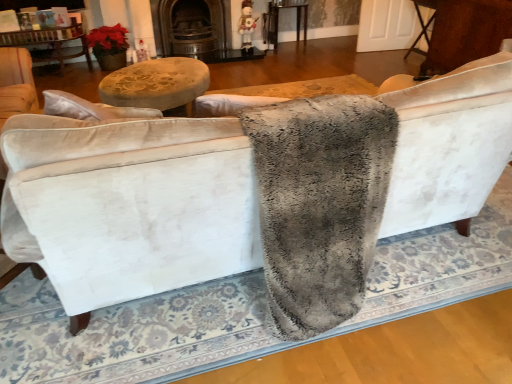
I want to click on gray fluffy blanket at center, so click(x=319, y=204).

I want to click on wooden table at center, placed as the 1th table when sorted from back to front, so click(x=278, y=19).

Where is `dark brown wood fireplace at upper center`? dark brown wood fireplace at upper center is located at coordinates (190, 27).

Find the location of a particular element. gray fluffy blanket at center is located at coordinates (319, 204).

How many degrees apart are the facing directions of wooden table at center, placed as the 2th table when sorted from front to back, and gray fluffy blanket at center?

They differ by 179 degrees in their facing directions.

Does wooden table at center, placed as the 2th table when sorted from front to back, have a lesser width compared to gray fluffy blanket at center?

Correct, the width of wooden table at center, placed as the 2th table when sorted from front to back, is less than that of gray fluffy blanket at center.

In the scene shown: Does wooden table at center, placed as the 2th table when sorted from front to back, have a smaller size compared to gray fluffy blanket at center?

Yes, wooden table at center, placed as the 2th table when sorted from front to back, is smaller than gray fluffy blanket at center.

Is wooden table at center, acting as the 1th table starting from the left, outside of gray fluffy blanket at center?

Yes.

Can you confirm if brown wood table at right, the second table positioned from the left, is bigger than gray fluffy blanket at center?

Actually, brown wood table at right, the second table positioned from the left, might be smaller than gray fluffy blanket at center.

In the image, is brown wood table at right, the second table viewed from the back, positioned in front of or behind gray fluffy blanket at center?

Clearly, brown wood table at right, the second table viewed from the back, is behind gray fluffy blanket at center.

Image resolution: width=512 pixels, height=384 pixels. There is a gray fluffy blanket at center. Identify the location of the 1st table below it (from a real-world perspective). (466, 32).

Does point (499, 0) appear closer or farther from the camera than point (349, 191)?

Point (499, 0) appears to be farther away from the viewer than point (349, 191).

Which of these two, gray fluffy blanket at center or wooden table at center, acting as the 1th table starting from the left, stands taller?

Standing taller between the two is gray fluffy blanket at center.

Which is behind, gray fluffy blanket at center or wooden table at center, placed as the 1th table when sorted from back to front?

wooden table at center, placed as the 1th table when sorted from back to front, is behind.

Does gray fluffy blanket at center have a greater width compared to wooden table at center, which is the 2th table from right to left?

Indeed, gray fluffy blanket at center has a greater width compared to wooden table at center, which is the 2th table from right to left.

Between dark brown wood fireplace at upper center and wooden table at center, which is the 2th table from right to left, which one appears on the right side from the viewer's perspective?

wooden table at center, which is the 2th table from right to left.

Is point (209, 17) less distant than point (305, 41)?

Yes, point (209, 17) is in front of point (305, 41).

From a real-world perspective, does dark brown wood fireplace at upper center stand above wooden table at center, acting as the 1th table starting from the left?

Indeed, from a real-world perspective, dark brown wood fireplace at upper center stands above wooden table at center, acting as the 1th table starting from the left.

Would you consider dark brown wood fireplace at upper center to be distant from wooden table at center, placed as the 1th table when sorted from back to front?

No, dark brown wood fireplace at upper center is in close proximity to wooden table at center, placed as the 1th table when sorted from back to front.

Looking at their sizes, would you say gray fluffy blanket at center is wider or thinner than brown wood table at right, the first table positioned from the right?

Clearly, gray fluffy blanket at center has more width compared to brown wood table at right, the first table positioned from the right.

From a real-world perspective, is gray fluffy blanket at center under brown wood table at right, the first table positioned from the right?

No.

Is gray fluffy blanket at center at the right side of brown wood table at right, the first table positioned from the right?

Incorrect, gray fluffy blanket at center is not on the right side of brown wood table at right, the first table positioned from the right.

Is gray fluffy blanket at center far away from brown wood table at right, the second table positioned from the left?

Yes, gray fluffy blanket at center and brown wood table at right, the second table positioned from the left, are quite far apart.

Locate an element on the screen. This screenshot has height=384, width=512. blanket below the dark brown wood fireplace at upper center (from the image's perspective) is located at coordinates (319, 204).

Is gray fluffy blanket at center positioned far away from dark brown wood fireplace at upper center?

That's right, there is a large distance between gray fluffy blanket at center and dark brown wood fireplace at upper center.

From the picture: How many degrees apart are the facing directions of gray fluffy blanket at center and dark brown wood fireplace at upper center?

179 degrees.

From a real-world perspective, which object stands above the other?

gray fluffy blanket at center, from a real-world perspective.

Would you consider brown wood table at right, the second table positioned from the left, to be distant from wooden table at center, placed as the 2th table when sorted from front to back?

brown wood table at right, the second table positioned from the left, is positioned a significant distance from wooden table at center, placed as the 2th table when sorted from front to back.

Can you confirm if brown wood table at right, which appears as the 1th table when viewed from the front, is bigger than wooden table at center, acting as the 1th table starting from the left?

Correct, brown wood table at right, which appears as the 1th table when viewed from the front, is larger in size than wooden table at center, acting as the 1th table starting from the left.

Relative to wooden table at center, placed as the 2th table when sorted from front to back, is brown wood table at right, the first table positioned from the right, in front or behind?

Clearly, brown wood table at right, the first table positioned from the right, is in front of wooden table at center, placed as the 2th table when sorted from front to back.

The height and width of the screenshot is (384, 512). Identify the location of table that is the 2nd object located above the gray fluffy blanket at center (from the image's perspective). (278, 19).

Locate an element on the screen. blanket above the brown wood table at right, the first table positioned from the right (from a real-world perspective) is located at coordinates (319, 204).

Based on their spatial positions, is dark brown wood fireplace at upper center or gray fluffy blanket at center closer to brown wood table at right, the first table positioned from the right?

dark brown wood fireplace at upper center is closer to brown wood table at right, the first table positioned from the right.

Looking at the image, which one is located further to gray fluffy blanket at center, dark brown wood fireplace at upper center or wooden table at center, which is the 2th table from right to left?

wooden table at center, which is the 2th table from right to left, lies further to gray fluffy blanket at center than the other object.

Looking at the image, which one is located closer to gray fluffy blanket at center, brown wood table at right, the first table positioned from the right, or dark brown wood fireplace at upper center?

brown wood table at right, the first table positioned from the right, is positioned closer to the anchor gray fluffy blanket at center.

Estimate the real-world distances between objects in this image. Which object is further from dark brown wood fireplace at upper center, wooden table at center, placed as the 2th table when sorted from front to back, or brown wood table at right, the first table positioned from the right?

brown wood table at right, the first table positioned from the right, lies further to dark brown wood fireplace at upper center than the other object.

Considering their positions, is wooden table at center, which is the 2th table from right to left, positioned further to gray fluffy blanket at center than dark brown wood fireplace at upper center?

wooden table at center, which is the 2th table from right to left.

Considering their positions, is wooden table at center, placed as the 1th table when sorted from back to front, positioned closer to brown wood table at right, which appears as the 1th table when viewed from the front, than dark brown wood fireplace at upper center?

Among the two, wooden table at center, placed as the 1th table when sorted from back to front, is located nearer to brown wood table at right, which appears as the 1th table when viewed from the front.

Which object lies nearer to the anchor point dark brown wood fireplace at upper center, wooden table at center, placed as the 1th table when sorted from back to front, or gray fluffy blanket at center?

wooden table at center, placed as the 1th table when sorted from back to front, is closer to dark brown wood fireplace at upper center.

Considering their positions, is gray fluffy blanket at center positioned further to wooden table at center, placed as the 2th table when sorted from front to back, than dark brown wood fireplace at upper center?

gray fluffy blanket at center is positioned further to the anchor wooden table at center, placed as the 2th table when sorted from front to back.

Find the location of `fireplace between gray fluffy blanket at center and wooden table at center, acting as the 1th table starting from the left, in the front-back direction`. fireplace between gray fluffy blanket at center and wooden table at center, acting as the 1th table starting from the left, in the front-back direction is located at coordinates (190, 27).

Find the location of a particular element. The width and height of the screenshot is (512, 384). table between gray fluffy blanket at center and dark brown wood fireplace at upper center in the front-back direction is located at coordinates (466, 32).

Where is `table situated between dark brown wood fireplace at upper center and brown wood table at right, the second table positioned from the left, from left to right`? table situated between dark brown wood fireplace at upper center and brown wood table at right, the second table positioned from the left, from left to right is located at coordinates (278, 19).

Identify the location of table between gray fluffy blanket at center and wooden table at center, placed as the 1th table when sorted from back to front, in the front-back direction. (466, 32).